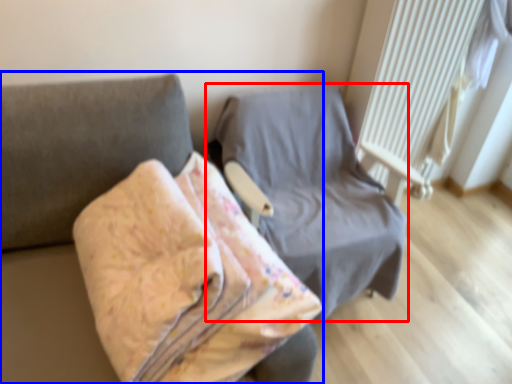
Question: Which object is further to the camera taking this photo, furniture (highlighted by a red box) or furniture (highlighted by a blue box)?

Choices:
 (A) furniture
 (B) furniture

Answer: (A)